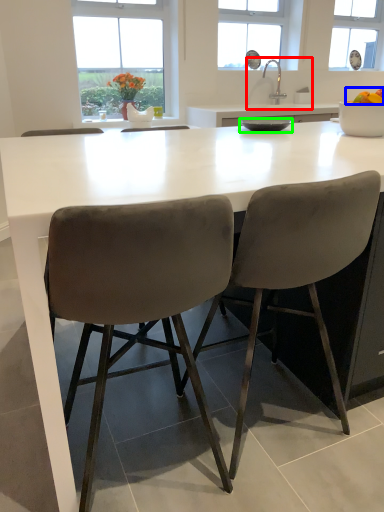
Question: Which object is positioned closest to sink (highlighted by a red box)? Select from food (highlighted by a blue box) and bowl (highlighted by a green box).

Choices:
 (A) food
 (B) bowl

Answer: (B)